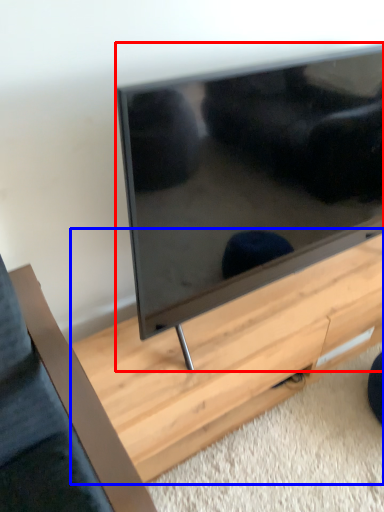
Question: Which object is closer to the camera taking this photo, television (highlighted by a red box) or table (highlighted by a blue box)?

Choices:
 (A) television
 (B) table

Answer: (A)